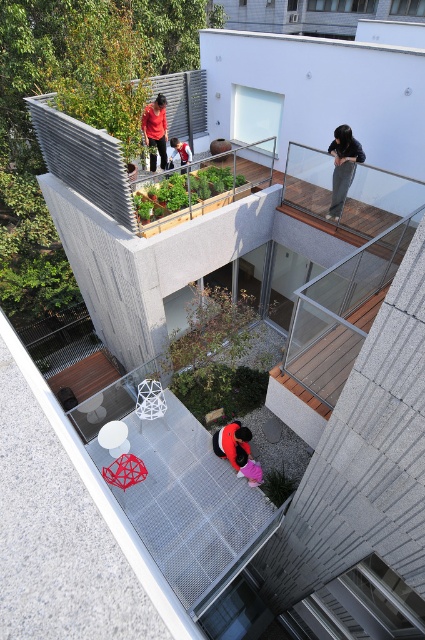
From the picture: You are a photographer setting up a shoot on the rooftop terrace. You notice two people wearing the matte red shirt at upper center and the matte black jacket at upper center. Which clothing item appears narrower when viewed from your position?

The matte red shirt at upper center appears narrower because it has a lesser width compared to the matte black jacket at upper center.

You are a photographer planning to take a group photo of the matte red shirt at upper center and the matte black jacket at upper center. Based on their heights, which one should you position closer to the camera to ensure both appear equally tall in the photo?

The matte red shirt at upper center is not as tall as the matte black jacket at upper center. To make them appear equally tall in the photo, position the matte red shirt at upper center closer to the camera since it is shorter, and the matte black jacket at upper center further back.

You are a photographer trying to capture a shot of the dark gray pants at upper right and the matte pink dress at lower center. Which one will appear larger in the photo due to their height?

The dark gray pants at upper right is taller than the matte pink dress at lower center, so it will appear larger in the photo.